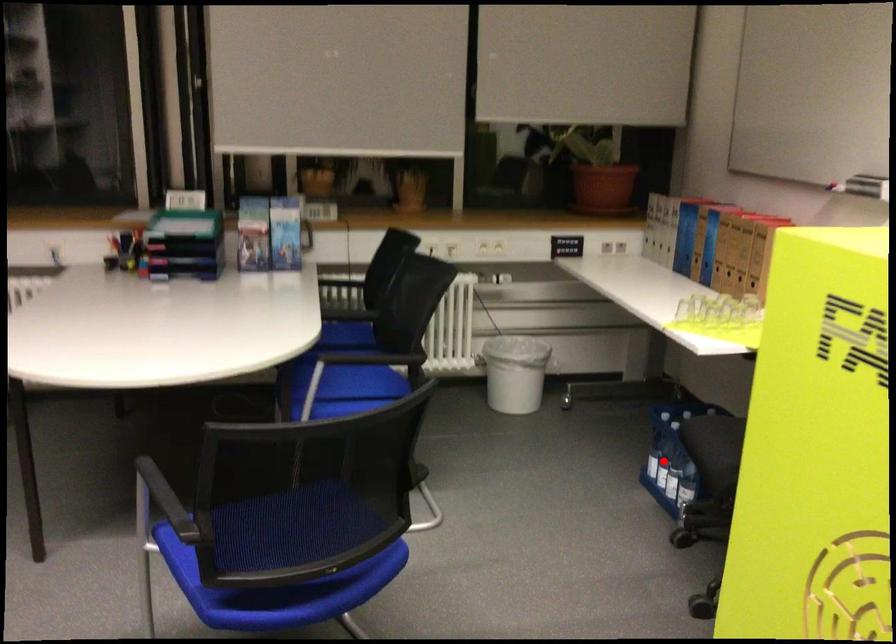
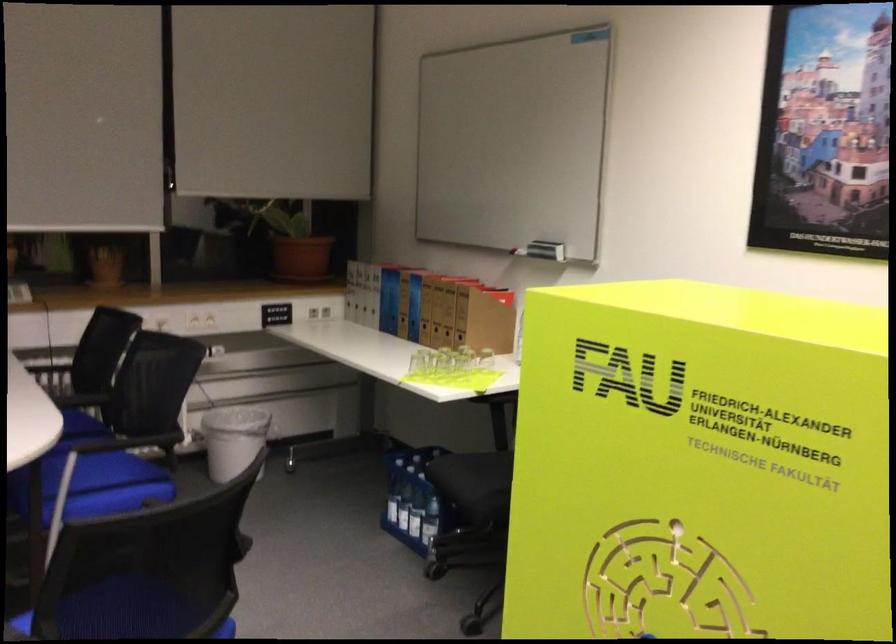
Locate, in the second image, the point that corresponds to the highlighted location in the first image.

(403, 507)